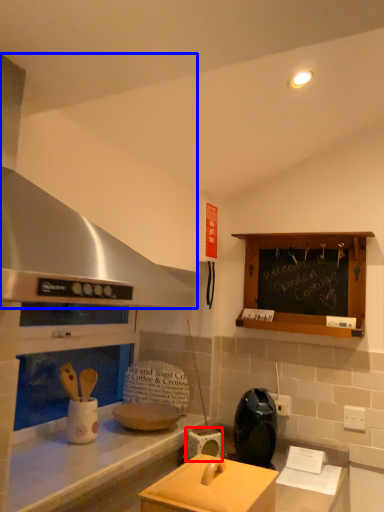
Question: Which point is further to the camera, appliance (highlighted by a red box) or exhaust hood (highlighted by a blue box)?

Choices:
 (A) appliance
 (B) exhaust hood

Answer: (A)